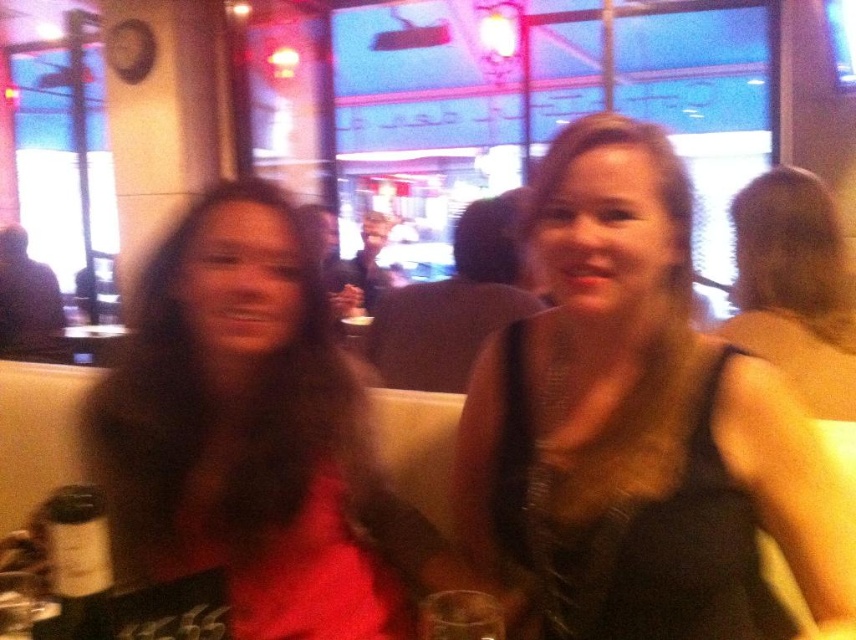
Question: Can you confirm if matte black dress at center is positioned below dark brown glass bottle at lower left?

Choices:
 (A) yes
 (B) no

Answer: (B)

Question: Estimate the real-world distances between objects in this image. Which object is farther from the matte black dress at center?

Choices:
 (A) black sequined dress at center
 (B) dark brown glass bottle at lower left

Answer: (B)

Question: Which point is closer to the camera?

Choices:
 (A) (68, 512)
 (B) (293, 339)
 (C) (750, 394)

Answer: (A)

Question: Does black sequined dress at center have a larger size compared to dark brown glass bottle at lower left?

Choices:
 (A) no
 (B) yes

Answer: (B)

Question: Can you confirm if black sequined dress at center is positioned to the left of matte black dress at center?

Choices:
 (A) no
 (B) yes

Answer: (A)

Question: Based on their relative distances, which object is nearer to the black sequined dress at center?

Choices:
 (A) dark brown glass bottle at lower left
 (B) matte black dress at center

Answer: (B)